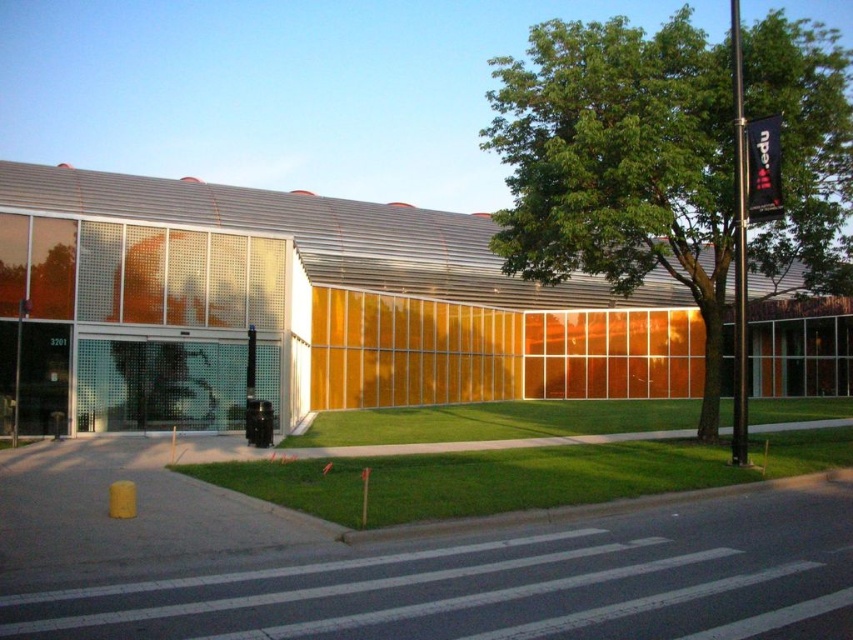
Question: Is green leafy tree at upper right closer to camera compared to green grass at lower center?

Choices:
 (A) no
 (B) yes

Answer: (A)

Question: Which object is positioned farthest from the black matte traffic light at center?

Choices:
 (A) green leafy tree at upper right
 (B) green grass at lower center

Answer: (A)

Question: Among these points, which one is farthest from the camera?

Choices:
 (A) (756, 104)
 (B) (514, 410)
 (C) (250, 406)

Answer: (B)

Question: Which point is farther to the camera?

Choices:
 (A) green grass at lower center
 (B) green leafy tree at upper right
 (C) black matte traffic light at center

Answer: (C)

Question: Can you confirm if green leafy tree at upper right is positioned above green grass at lower center?

Choices:
 (A) no
 (B) yes

Answer: (B)

Question: Is green leafy tree at upper right wider than green grass at lower center?

Choices:
 (A) no
 (B) yes

Answer: (B)